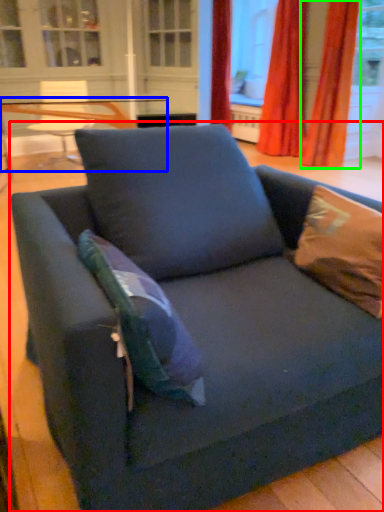
Question: Based on their relative distances, which object is nearer to studio couch (highlighted by a red box)? Choose from table (highlighted by a blue box) and curtain (highlighted by a green box).

Choices:
 (A) table
 (B) curtain

Answer: (A)